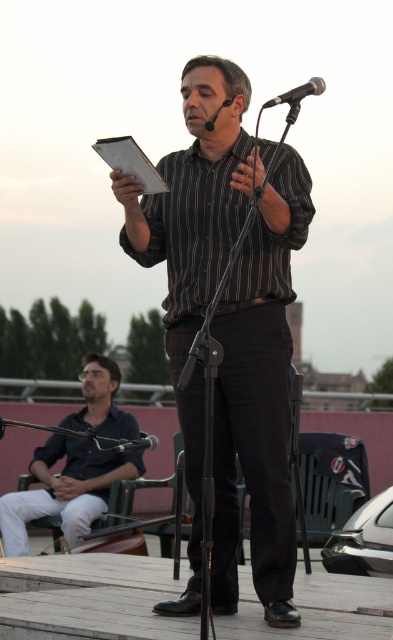
Is the position of dark blue shirt at lower left less distant than that of black metallic microphone at center?

That is False.

Which of these two, dark blue shirt at lower left or black metallic microphone at center, stands shorter?

Standing shorter between the two is black metallic microphone at center.

What are the coordinates of `dark blue shirt at lower left` in the screenshot? It's located at [64, 490].

Can you confirm if striped cotton shirt at center is bigger than black metallic microphone at center?

Yes, striped cotton shirt at center is bigger than black metallic microphone at center.

Who is taller, striped cotton shirt at center or black metallic microphone at center?

striped cotton shirt at center

Who is more forward, (x=165, y=214) or (x=321, y=81)?

Point (x=321, y=81)

Identify the location of striped cotton shirt at center. (258, 400).

Is metallic silver microphone at center taller than black matte microphone at center?

Yes, metallic silver microphone at center is taller than black matte microphone at center.

Is point (156, 440) farther from camera compared to point (211, 125)?

Yes, point (156, 440) is farther from viewer.

Where is `metallic silver microphone at center`? metallic silver microphone at center is located at coordinates (135, 444).